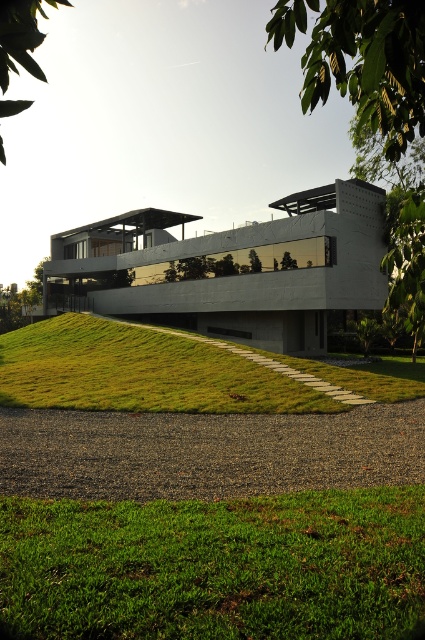
You are standing at the entrance of the building and want to walk towards the green leafy tree at upper left. Which direction should you walk relative to the green grass at center?

To reach the green leafy tree at upper left from the entrance, you should walk to the left of the green grass at center since the green grass at center is to the right of the green leafy tree at upper left.

You are standing at the entrance of the building and want to walk towards the green leafy tree at upper right. Which direction should you walk relative to the green grass at center?

You should walk to the right of the green grass at center because the green leafy tree at upper right is located to the right side of the green grass at center.

You are a gardener standing at the base of the green leafy tree at upper right, and you need to water the green grassy at lower center. If your hose can reach 10 feet, will you be able to water it without moving the hose?

The distance between the green grassy at lower center and the green leafy tree at upper right is 12.27 feet, which is beyond the 10 feet reach of the hose. Therefore, you will need to move the hose closer to reach the green grassy at lower center.